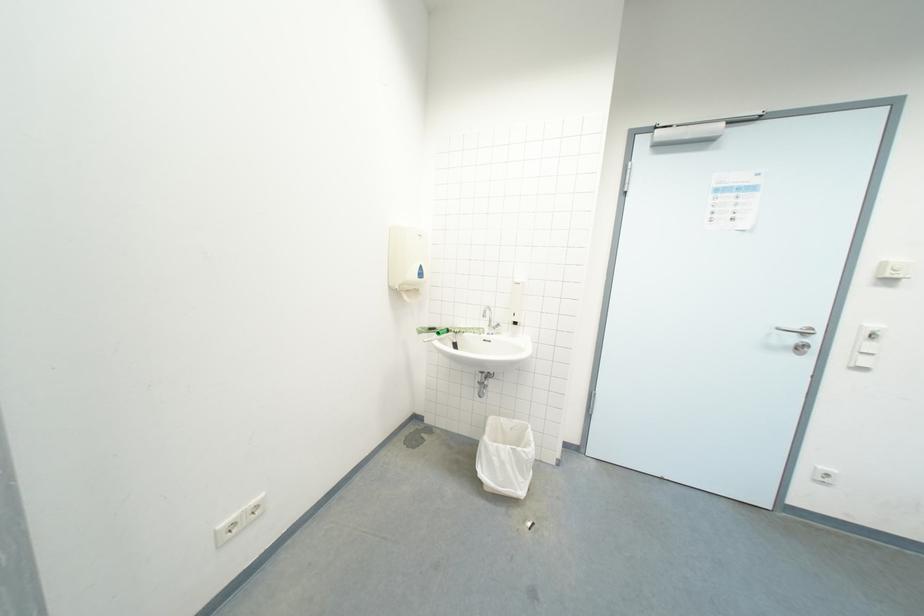
Find the location of a particular element. The image size is (924, 616). dispenser lever is located at coordinates (490, 321).